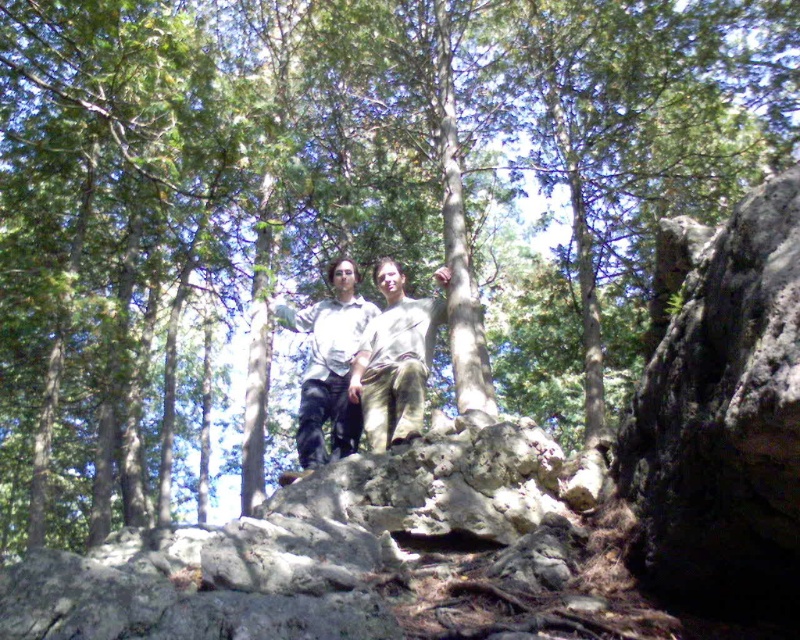
Question: In this image, where is light brown cotton pants at center located relative to light brown cotton shirt at center?

Choices:
 (A) right
 (B) left

Answer: (A)

Question: Is light brown cotton pants at center to the left of light brown cotton shirt at center from the viewer's perspective?

Choices:
 (A) no
 (B) yes

Answer: (A)

Question: Can you confirm if light brown cotton pants at center is positioned to the left of light brown cotton shirt at center?

Choices:
 (A) no
 (B) yes

Answer: (A)